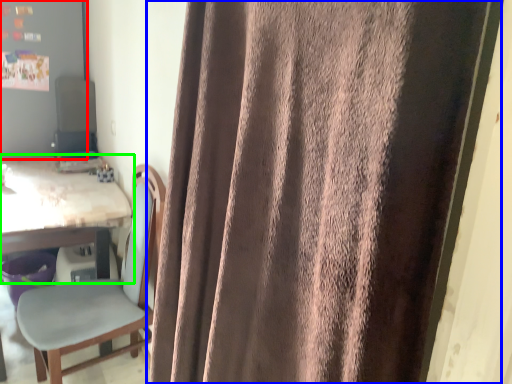
Question: Which object is positioned farthest from bulletin board (highlighted by a red box)? Select from curtain (highlighted by a blue box) and table (highlighted by a green box).

Choices:
 (A) curtain
 (B) table

Answer: (A)